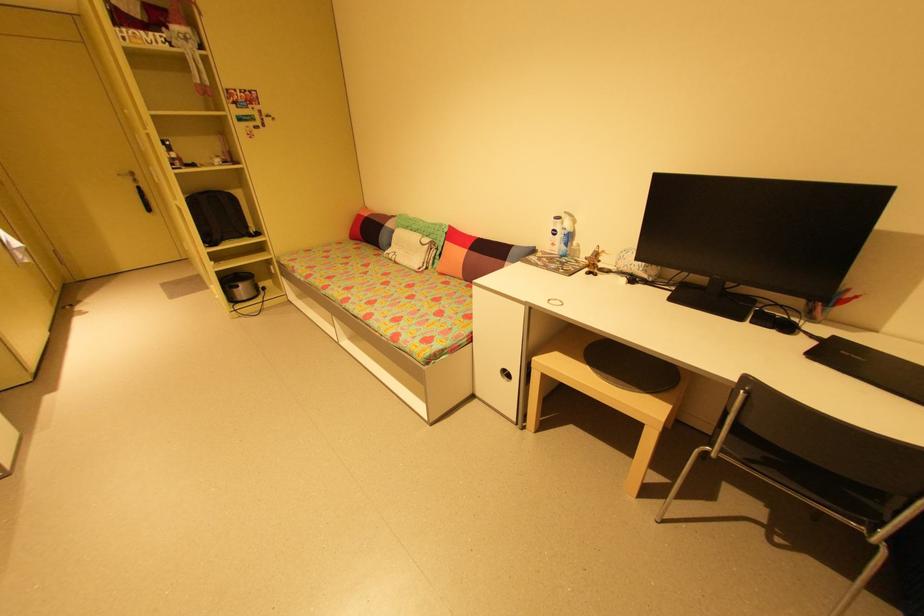
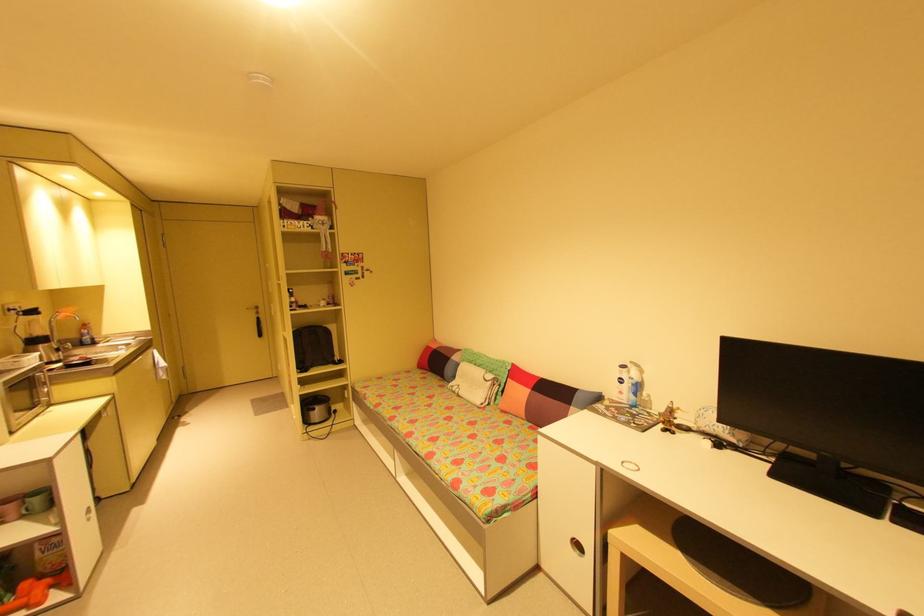
Question: In a continuous first-person perspective shot, in which direction is the camera moving?

Choices:
 (A) Left
 (B) Right
 (C) Forward
 (D) Backward

Answer: (D)